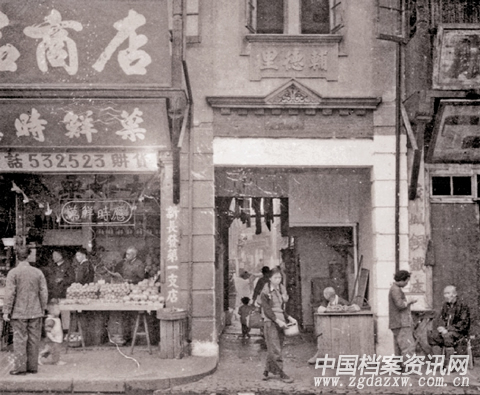
This screenshot has height=395, width=480. Find the location of `doorway`. doorway is located at coordinates (234, 246), (264, 243).